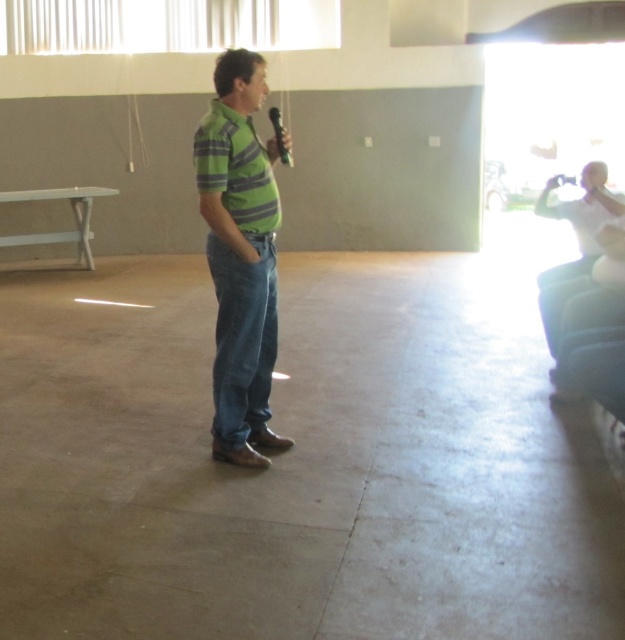
Is green striped shirt at center closer to the viewer compared to metallic shiny microphone at center?

Yes, it is in front of metallic shiny microphone at center.

Locate an element on the screen. Image resolution: width=625 pixels, height=640 pixels. green striped shirt at center is located at coordinates (x=241, y=257).

Where is `green striped shirt at center`? green striped shirt at center is located at coordinates 241,257.